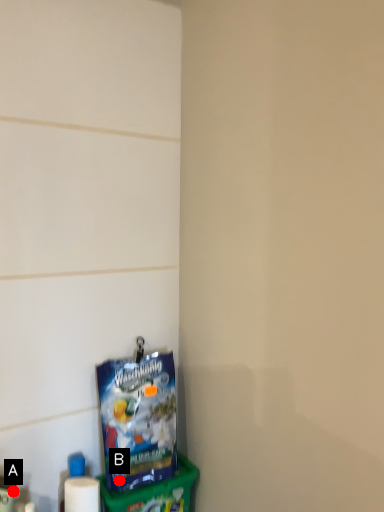
Question: Two points are circled on the image, labeled by A and B beside each circle. Which point is closer to the camera taking this photo?

Choices:
 (A) A is closer
 (B) B is closer

Answer: (A)